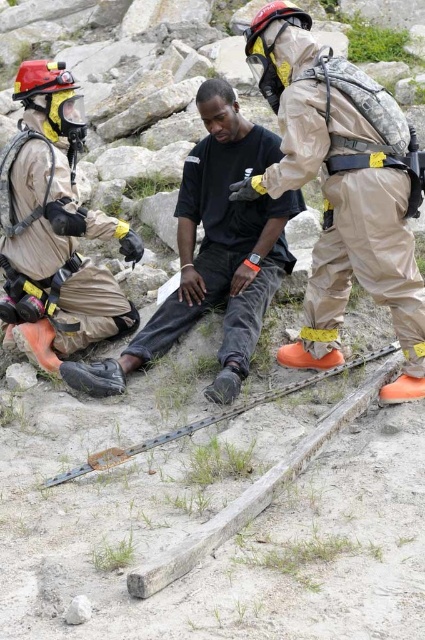
You are a bystander observing the rescue operation. The tan protective suit at center and the black cotton shirt at center are both visible. Which clothing item is covering part of the other?

The tan protective suit at center is positioned over the black cotton shirt at center, so it is covering part of the black cotton shirt at center.

You are a safety officer assessing the rescue operation. The tan protective suit at center and the metal chain at center are both critical to the operation. Which item requires more space to store? Please explain your reasoning based on their sizes.

The tan protective suit at center requires more storage space because it is bigger than the metal chain at center.